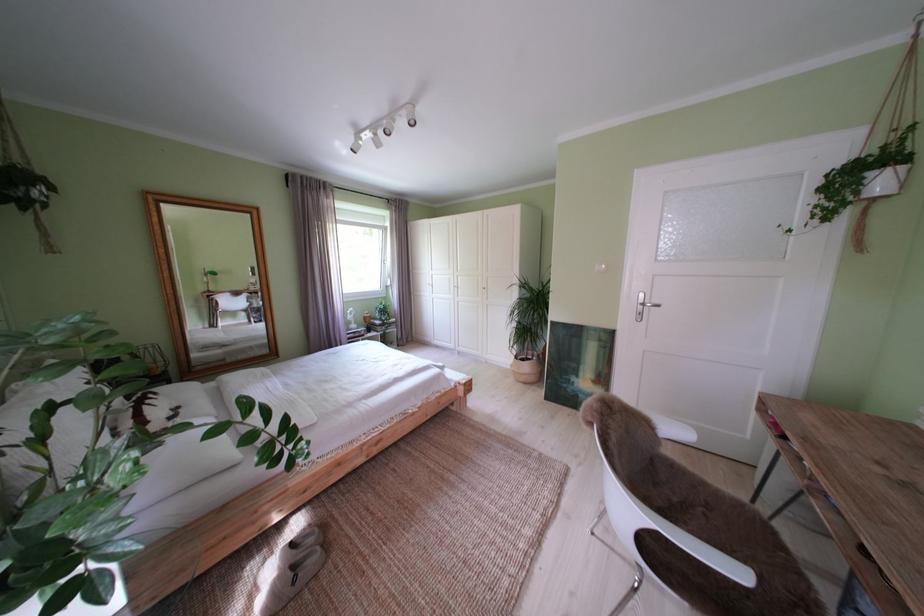
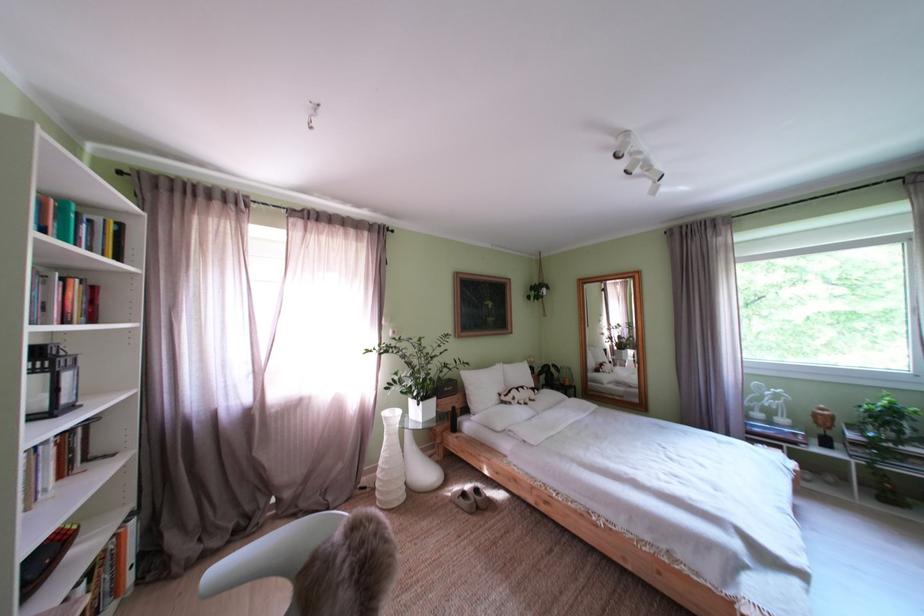
Where in the second image is the point corresponding to pixel 377 323 from the first image?

(825, 419)